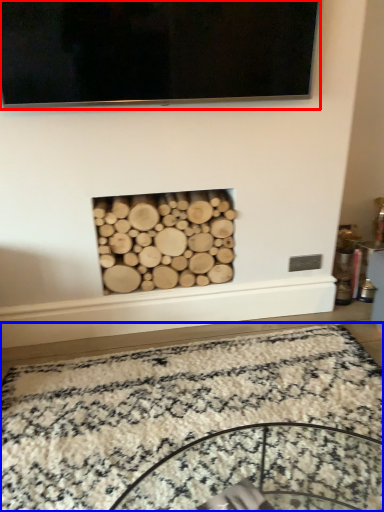
Question: Which object appears farthest to the camera in this image, television (highlighted by a red box) or mat (highlighted by a blue box)?

Choices:
 (A) television
 (B) mat

Answer: (A)